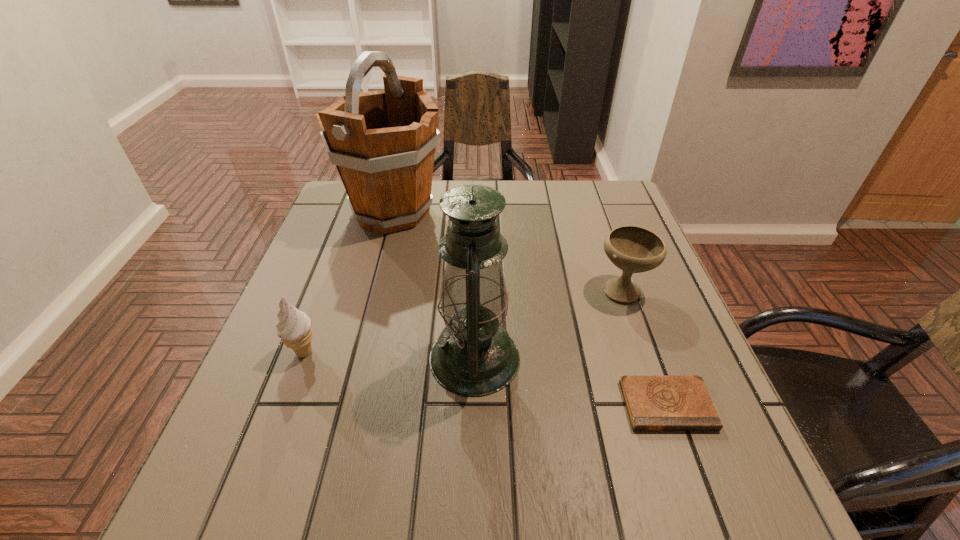
Where is `free space that satisfies the following two spatial constraints: 1. on the front side of the bucket; 2. on the front-facing side of the icecream`? Image resolution: width=960 pixels, height=540 pixels. free space that satisfies the following two spatial constraints: 1. on the front side of the bucket; 2. on the front-facing side of the icecream is located at coordinates (355, 352).